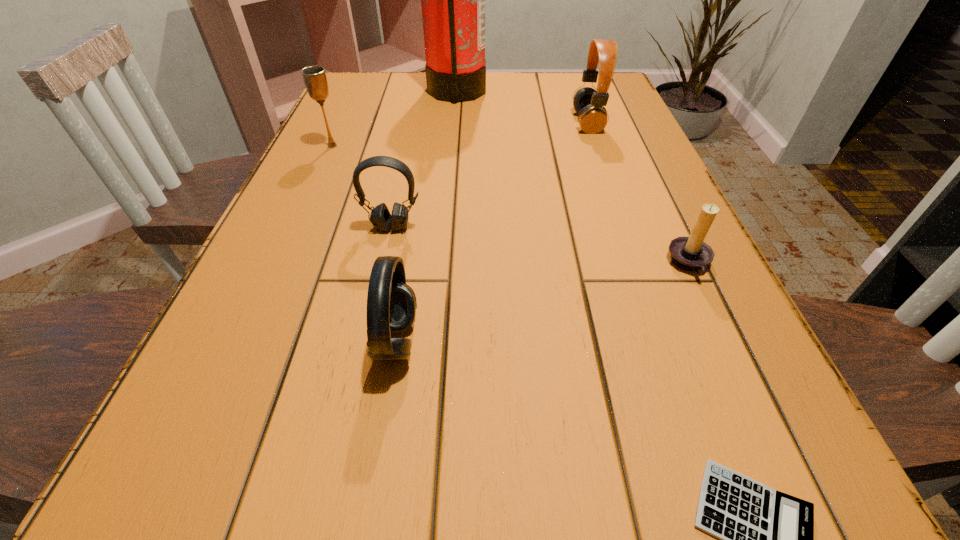
Image resolution: width=960 pixels, height=540 pixels. I want to click on free space located 0.150m on the ear cups of the farthest headset, so click(515, 123).

Where is `vacant region located on the ear cups of the farthest headset`? This screenshot has width=960, height=540. vacant region located on the ear cups of the farthest headset is located at coordinates (554, 123).

Identify the location of free point located 0.250m on the ear cups of the farthest headset. Image resolution: width=960 pixels, height=540 pixels. (475, 123).

Locate an element on the screen. This screenshot has height=540, width=960. vacant space situated on the front of the leftmost object is located at coordinates (303, 210).

Where is `vacant space located 0.050m on the front-facing side of the fourth farthest object`? The height and width of the screenshot is (540, 960). vacant space located 0.050m on the front-facing side of the fourth farthest object is located at coordinates (386, 253).

Where is `free space located 0.130m on the earcups of the nearest headset`? This screenshot has width=960, height=540. free space located 0.130m on the earcups of the nearest headset is located at coordinates pos(504,341).

Identify the location of vacant space located 0.270m on the wick of the sixth tallest object. (512, 265).

Where is `vacant space situated 0.060m on the wick of the sixth tallest object`? vacant space situated 0.060m on the wick of the sixth tallest object is located at coordinates (634, 265).

Image resolution: width=960 pixels, height=540 pixels. I want to click on free region located 0.300m on the wick of the sixth tallest object, so click(494, 265).

Find the location of a particular element. object that is at the far edge is located at coordinates (452, 0).